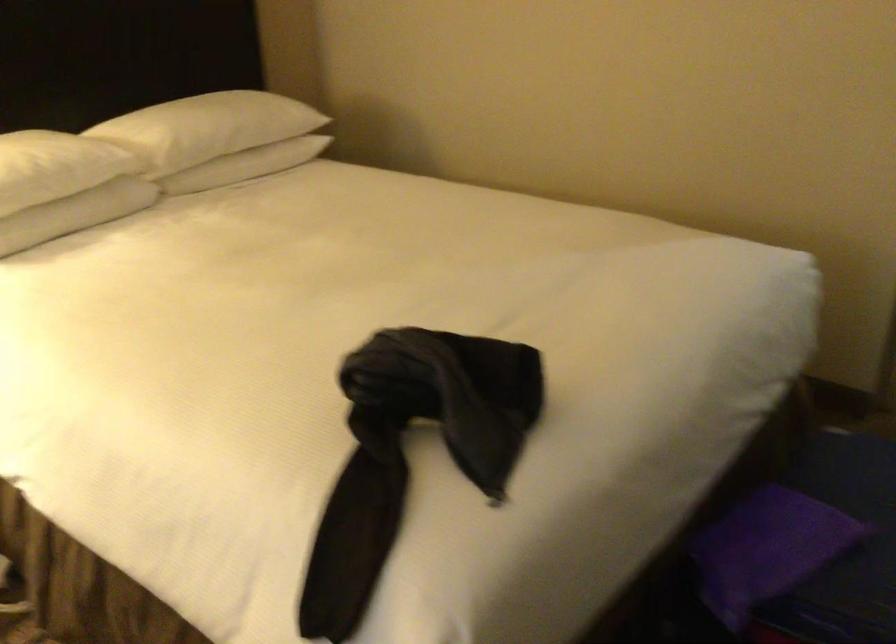
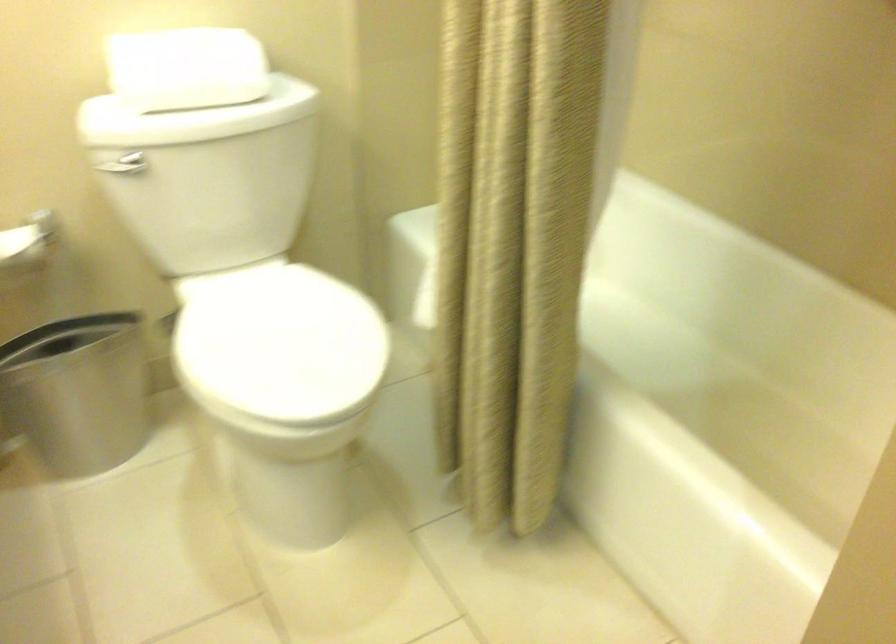
Which direction would the cameraman need to move to produce the second image?

The movement direction of the cameraman is right, forward.